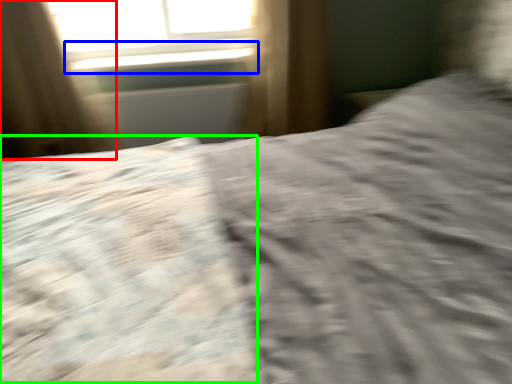
Question: Which object is positioned closest to curtain (highlighted by a red box)? Select from window sill (highlighted by a blue box) and sheet (highlighted by a green box).

Choices:
 (A) window sill
 (B) sheet

Answer: (A)